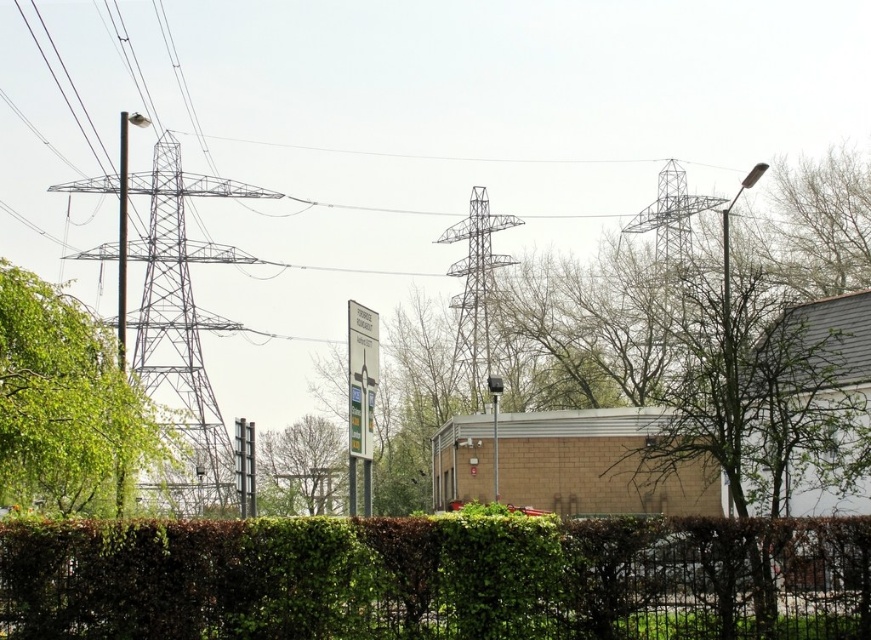
Does metallic pole at left appear under white plastic sign at center?

No, metallic pole at left is not below white plastic sign at center.

Is point (125, 211) less distant than point (497, 500)?

Yes, it is.

You are a GUI agent. You are given a task and a screenshot of the screen. Output one action in this format:
    pyautogui.click(x=<x>, y=<y>)
    Task: Click on the metallic pole at left
    The image size is (871, 640).
    Given the screenshot: What is the action you would take?
    pyautogui.click(x=122, y=232)

Can you confirm if green leafy hedge at lower center is smaller than metallic pole at left?

Correct, green leafy hedge at lower center occupies less space than metallic pole at left.

Which of these two, green leafy hedge at lower center or metallic pole at left, stands shorter?

With less height is green leafy hedge at lower center.

Locate an element on the screen. green leafy hedge at lower center is located at coordinates (436, 579).

Which is in front, point (144, 440) or point (497, 481)?

Point (144, 440) is in front.

Is green leafy tree at left above white plastic sign at center?

Incorrect, green leafy tree at left is not positioned above white plastic sign at center.

This screenshot has height=640, width=871. I want to click on green leafy tree at left, so click(66, 403).